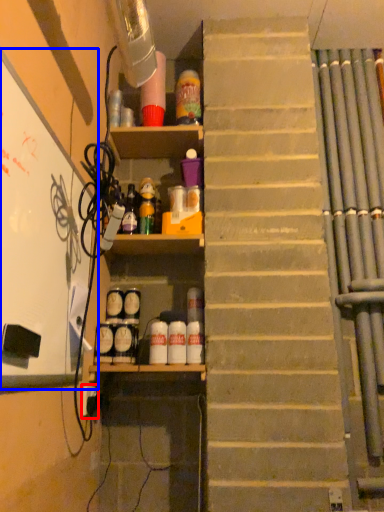
Question: Which point is closer to the camera, electric outlet (highlighted by a red box) or bulletin board (highlighted by a blue box)?

Choices:
 (A) electric outlet
 (B) bulletin board

Answer: (B)